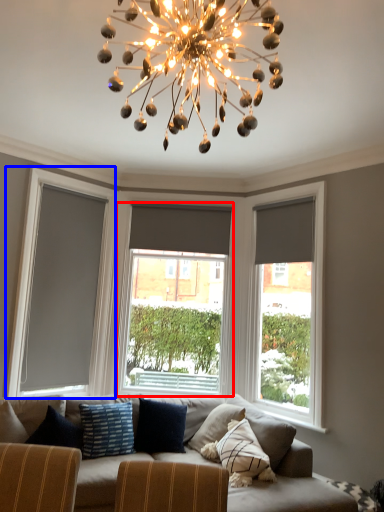
Question: Which object appears closest to the camera in this image, window (highlighted by a red box) or window screen (highlighted by a blue box)?

Choices:
 (A) window
 (B) window screen

Answer: (B)